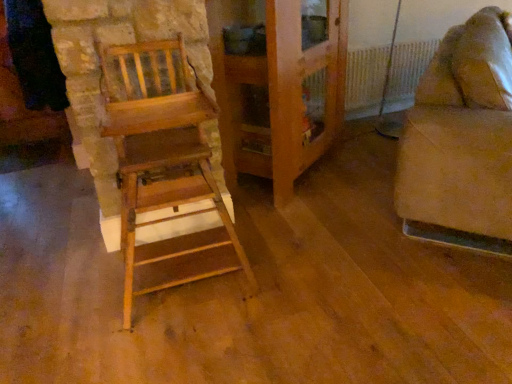
Question: From the image's perspective, would you say wooden chair at left, marked as the 2th furniture in a right-to-left arrangement, is positioned over beige fabric couch at right, which is the first furniture from right to left?

Choices:
 (A) no
 (B) yes

Answer: (A)

Question: Is wooden chair at left, marked as the 2th furniture in a right-to-left arrangement, in front of beige fabric couch at right, placed as the 2th furniture when sorted from left to right?

Choices:
 (A) yes
 (B) no

Answer: (A)

Question: Can you confirm if wooden chair at left, marked as the 2th furniture in a right-to-left arrangement, is positioned to the left of beige fabric couch at right, placed as the 2th furniture when sorted from left to right?

Choices:
 (A) no
 (B) yes

Answer: (B)

Question: Does wooden chair at left, marked as the 2th furniture in a right-to-left arrangement, come behind beige fabric couch at right, placed as the 2th furniture when sorted from left to right?

Choices:
 (A) no
 (B) yes

Answer: (A)

Question: Does wooden chair at left, placed as the 1th furniture when sorted from left to right, have a lesser height compared to beige fabric couch at right, placed as the 2th furniture when sorted from left to right?

Choices:
 (A) yes
 (B) no

Answer: (B)

Question: Is wooden chair at left, marked as the 2th furniture in a right-to-left arrangement, at the right side of beige fabric couch at right, placed as the 2th furniture when sorted from left to right?

Choices:
 (A) no
 (B) yes

Answer: (A)

Question: Is beige fabric couch at right, placed as the 2th furniture when sorted from left to right, in front of white plastic radiator at upper right?

Choices:
 (A) no
 (B) yes

Answer: (B)

Question: Could white plastic radiator at upper right be considered to be inside beige fabric couch at right, placed as the 2th furniture when sorted from left to right?

Choices:
 (A) no
 (B) yes

Answer: (A)

Question: Is beige fabric couch at right, placed as the 2th furniture when sorted from left to right, oriented towards white plastic radiator at upper right?

Choices:
 (A) no
 (B) yes

Answer: (A)

Question: Can you confirm if beige fabric couch at right, which is the first furniture from right to left, is taller than white plastic radiator at upper right?

Choices:
 (A) yes
 (B) no

Answer: (A)

Question: From a real-world perspective, is beige fabric couch at right, which is the first furniture from right to left, under white plastic radiator at upper right?

Choices:
 (A) yes
 (B) no

Answer: (B)

Question: From a real-world perspective, is wooden cabinet at center positioned under beige fabric couch at right, placed as the 2th furniture when sorted from left to right, based on gravity?

Choices:
 (A) yes
 (B) no

Answer: (B)